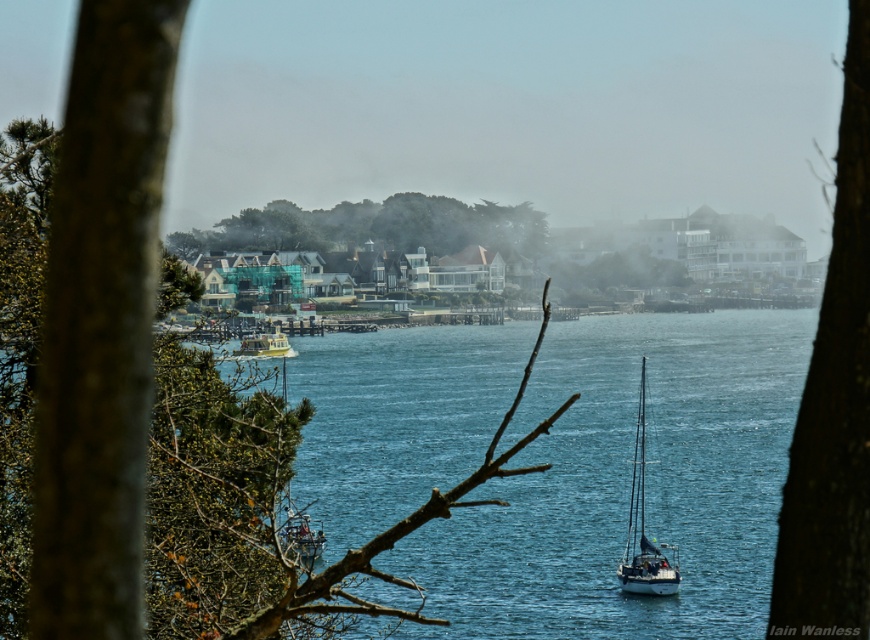
Consider the image. Can you confirm if brown rough bark tree at left is positioned above green leafy tree at center?

Actually, brown rough bark tree at left is below green leafy tree at center.

Can you confirm if brown rough bark tree at left is thinner than green leafy tree at center?

Correct, brown rough bark tree at left's width is less than green leafy tree at center's.

Is point (845, 67) farther from camera compared to point (333, 248)?

That is False.

Image resolution: width=870 pixels, height=640 pixels. What are the coordinates of `brown rough bark tree at left` in the screenshot? It's located at (833, 404).

Find the location of a particular element. white glossy sailboat at center is located at coordinates (643, 529).

Is white glossy sailboat at center smaller than metallic silver sailboat at center?

Correct, white glossy sailboat at center occupies less space than metallic silver sailboat at center.

Is point (636, 579) farther from camera compared to point (290, 524)?

Yes, it is.

At what (x,y) coordinates should I click in order to perform the action: click on white glossy sailboat at center. Please return your answer as a coordinate pair (x, y). Looking at the image, I should click on (643, 529).

Does blue water at center come behind brown rough bark tree at left?

That is True.

How much distance is there between blue water at center and brown rough bark tree at left?

The distance of blue water at center from brown rough bark tree at left is 178.05 meters.

Does point (666, 358) lie behind point (793, 636)?

Yes.

Identify the location of blue water at center. (627, 483).